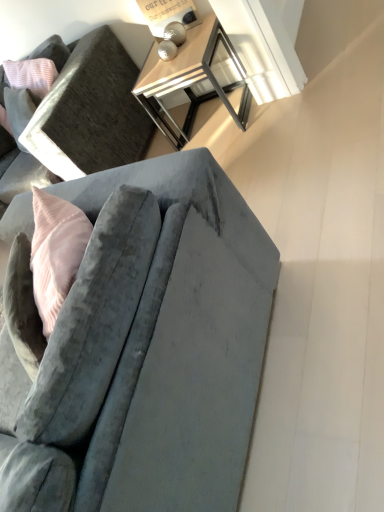
At what (x,y) coordinates should I click in order to perform the action: click on empty space that is ontop of metallic silver table at upper center. Please return your answer as a coordinate pair (x, y). The height and width of the screenshot is (512, 384). Looking at the image, I should click on (171, 56).